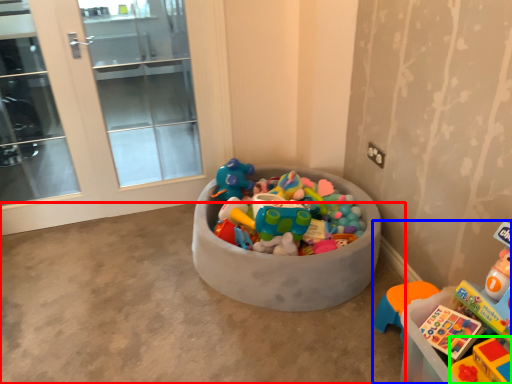
Question: Considering the real-world distances, which object is closest to concrete (highlighted by a red box)? toy (highlighted by a blue box) or toy (highlighted by a green box).

Choices:
 (A) toy
 (B) toy

Answer: (A)